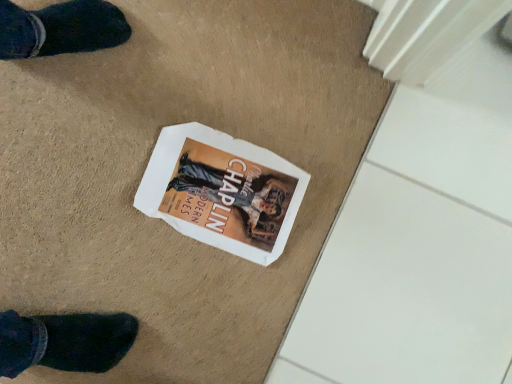
Where is `empty space that is ontop of white paper magazine at center (from a real-world perspective)`? This screenshot has height=384, width=512. empty space that is ontop of white paper magazine at center (from a real-world perspective) is located at coordinates (220, 193).